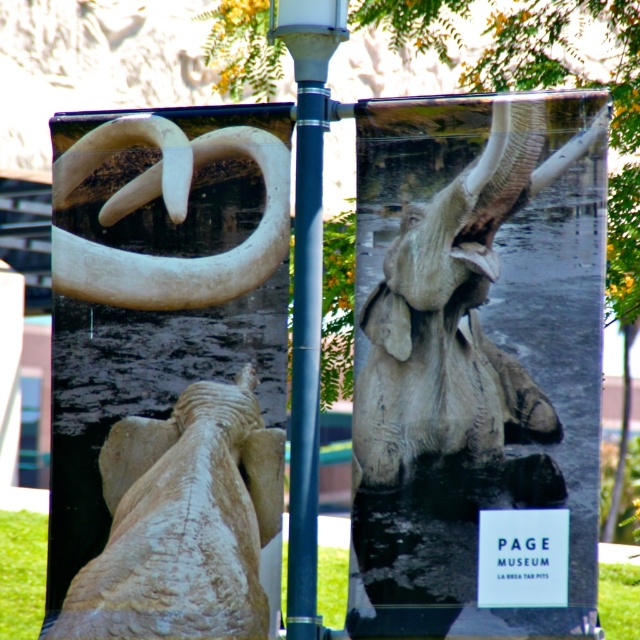
Who is taller, matte gray elephant at center or metallic gray pole at center?

metallic gray pole at center

Locate an element on the screen. matte gray elephant at center is located at coordinates (477, 364).

Who is higher up, rough stone elephant at center or metallic gray pole at center?

metallic gray pole at center is above.

Does rough stone elephant at center appear over metallic gray pole at center?

Incorrect, rough stone elephant at center is not positioned above metallic gray pole at center.

Is point (115, 477) closer to camera compared to point (296, 467)?

No, it is not.

Identify the location of rough stone elephant at center. (182, 522).

Between point (362, 476) and point (259, 616), which one is positioned in front?

Positioned in front is point (259, 616).

Which is more to the left, matte gray elephant at center or rough stone elephant at center?

Positioned to the left is rough stone elephant at center.

Is point (486, 140) behind point (156, 538)?

No.

Identify the location of matte gray elephant at center. The height and width of the screenshot is (640, 640). (477, 364).